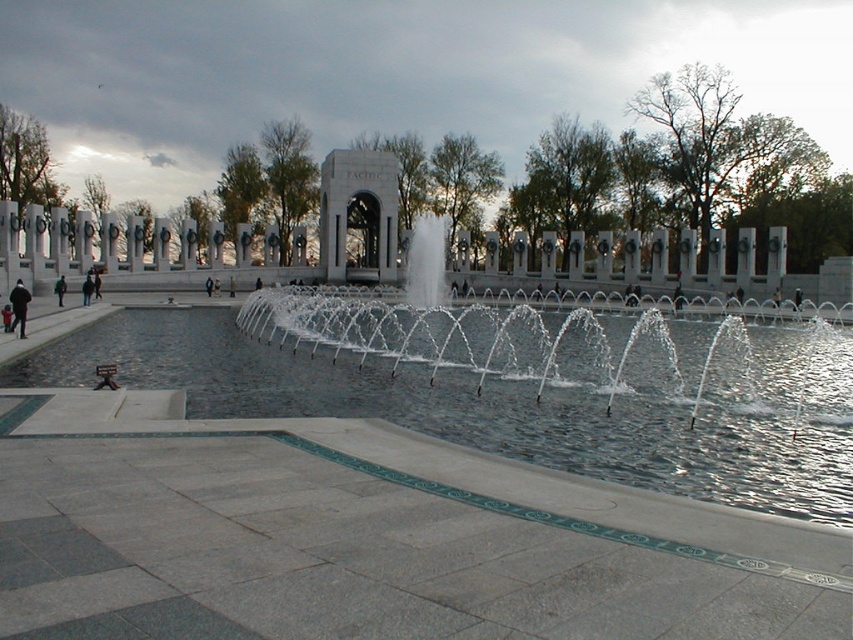
Between point (32, 358) and point (548, 346), which one is positioned behind?

The point (548, 346) is more distant.

Identify the location of clear glass pool at center. (527, 392).

Between point (251, 340) and point (576, 316), which one is positioned in front?

Point (576, 316) is more forward.

The image size is (853, 640). Find the location of `clear glass pool at center`. clear glass pool at center is located at coordinates (527, 392).

Does clear water at center appear over dark gray jacket at left?

Indeed, clear water at center is positioned over dark gray jacket at left.

Is point (677, 371) farther from camera compared to point (21, 298)?

No, (677, 371) is closer to viewer.

Measure the distance between point (438, 216) and camera.

They are 83.78 meters apart.

Find the location of `clear water at center`. clear water at center is located at coordinates (554, 337).

Measure the distance from clear glass pool at center to dark gray jacket at left.

12.93 meters

Who is lower down, clear glass pool at center or dark gray jacket at left?

clear glass pool at center is below.

The height and width of the screenshot is (640, 853). What do you see at coordinates (527, 392) in the screenshot?
I see `clear glass pool at center` at bounding box center [527, 392].

This screenshot has width=853, height=640. I want to click on clear glass pool at center, so click(x=527, y=392).